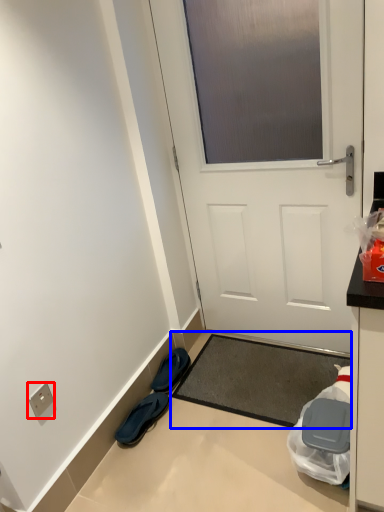
Question: Which point is closer to the camera, electric outlet (highlighted by a red box) or doormat (highlighted by a blue box)?

Choices:
 (A) electric outlet
 (B) doormat

Answer: (A)